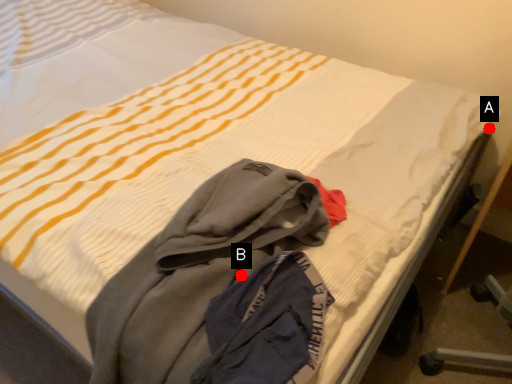
Question: Two points are circled on the image, labeled by A and B beside each circle. Which point is further to the camera?

Choices:
 (A) A is further
 (B) B is further

Answer: (A)